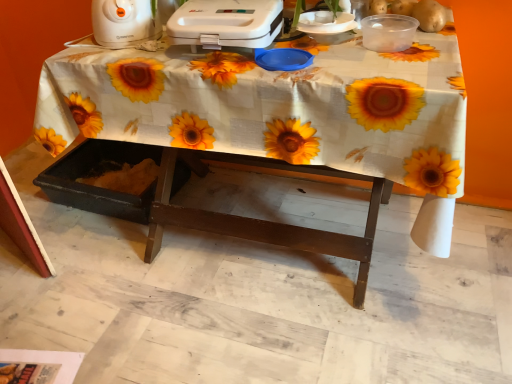
Image resolution: width=512 pixels, height=384 pixels. Find the location of `free space below white fabric-covered table at center (from a real-world perspective)`. free space below white fabric-covered table at center (from a real-world perspective) is located at coordinates (270, 252).